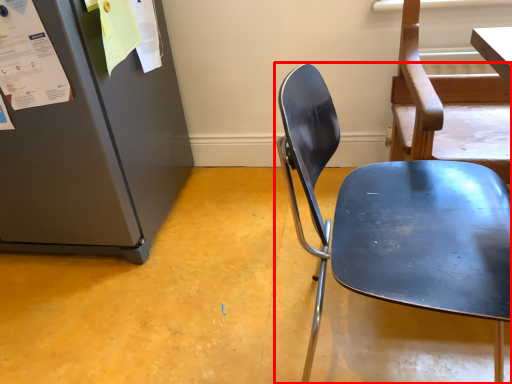
Question: From the image's perspective, where is chair (annotated by the red box) located relative to paper?

Choices:
 (A) above
 (B) below

Answer: (B)